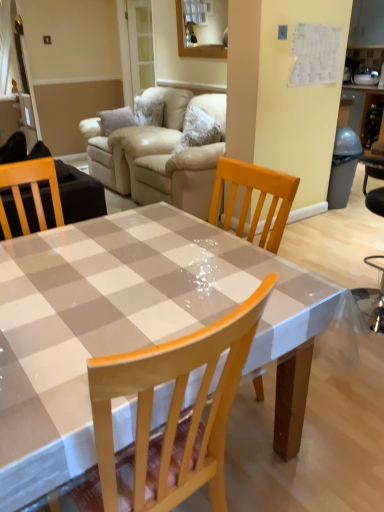
Find the location of a particular element. free point above clear plastic table at center (from a real-world perspective) is located at coordinates (127, 275).